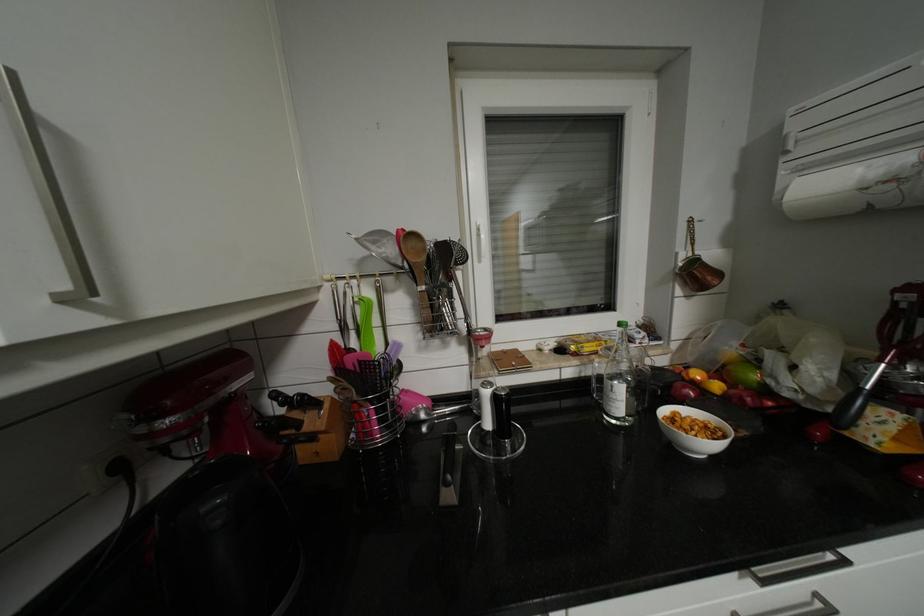
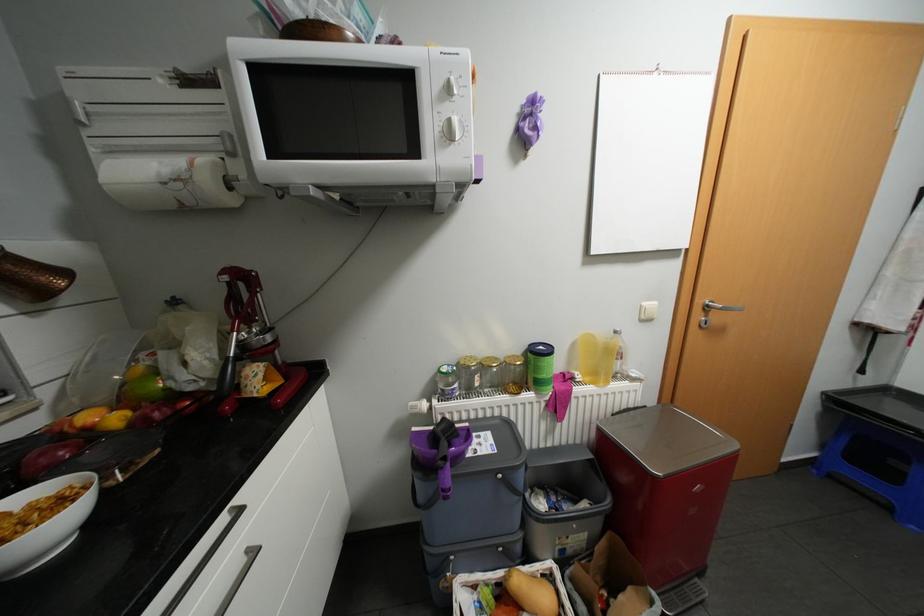
In the second image, find the point that corresponds to (724,386) in the first image.

(123, 418)